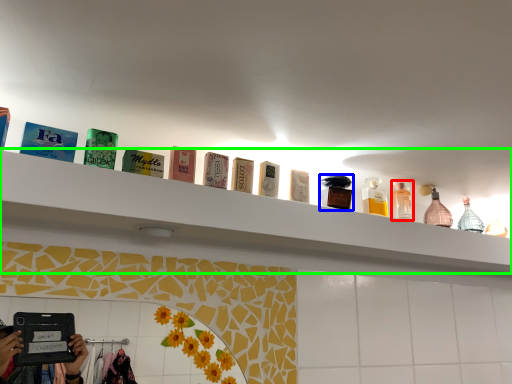
Question: Considering the real-world distances, which object is closest to toiletry (highlighted by a red box)? toiletry (highlighted by a blue box) or shelf (highlighted by a green box).

Choices:
 (A) toiletry
 (B) shelf

Answer: (A)